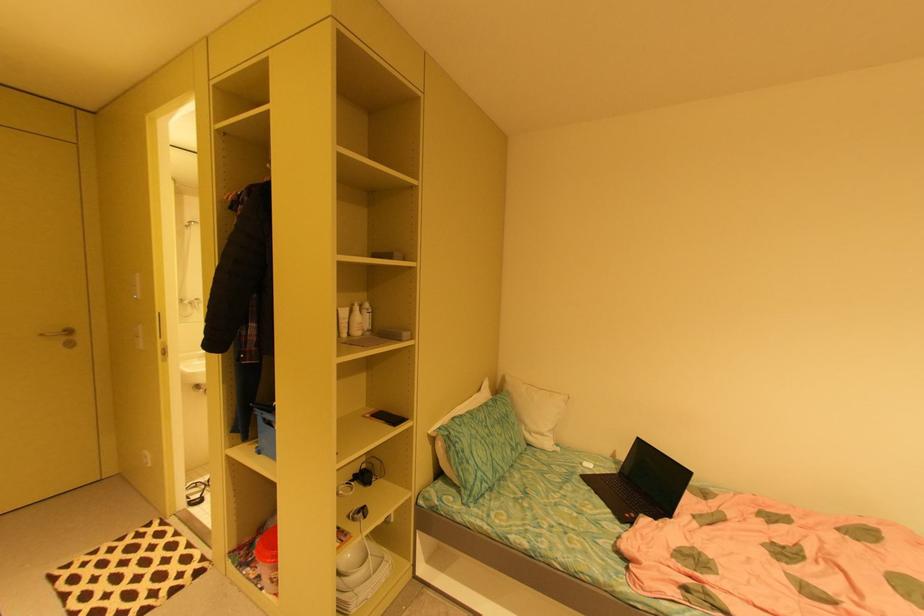
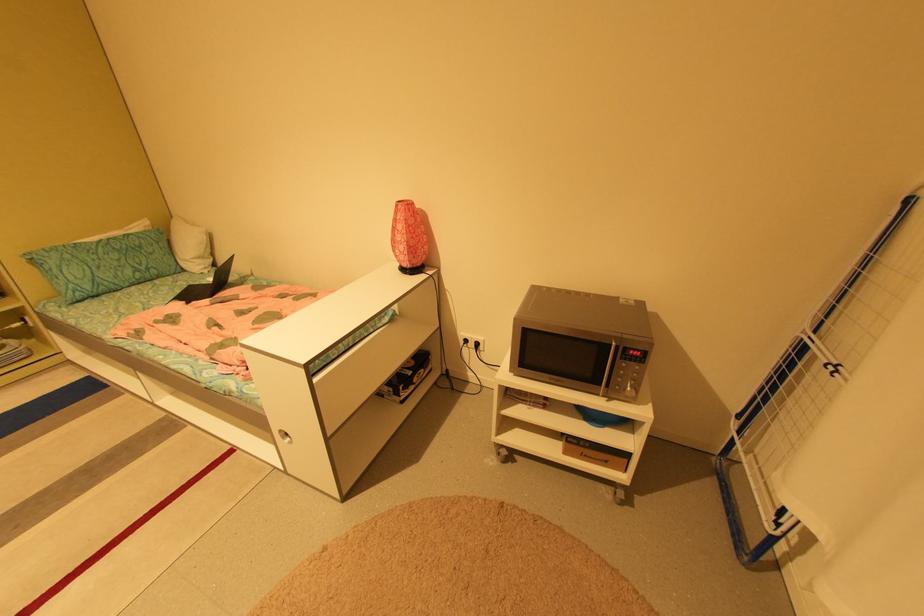
Find the pixel in the second image that matches the point at 535,445 in the first image.

(190, 270)